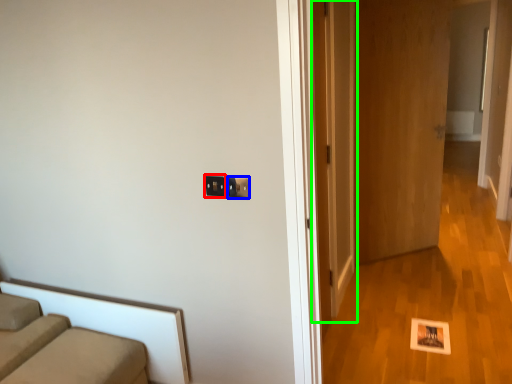
Question: Considering the real-world distances, which object is closest to electric outlet (highlighted by a red box)? electric outlet (highlighted by a blue box) or door (highlighted by a green box).

Choices:
 (A) electric outlet
 (B) door

Answer: (A)